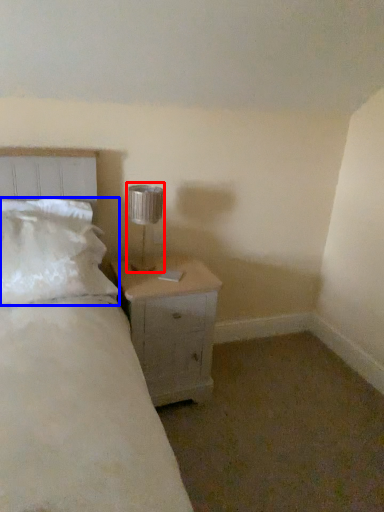
Question: Among these objects, which one is nearest to the camera, lamp (highlighted by a red box) or pillow (highlighted by a blue box)?

Choices:
 (A) lamp
 (B) pillow

Answer: (B)